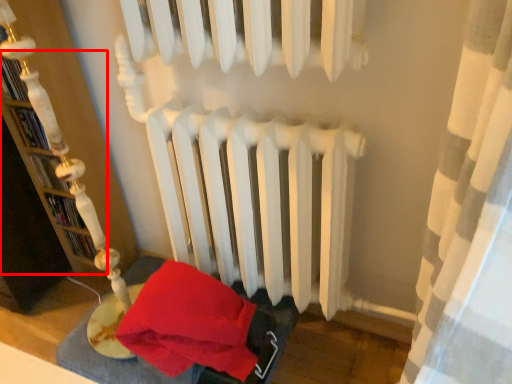
Question: In this image, where is bookshelf (annotated by the red box) located relative to bed frame?

Choices:
 (A) left
 (B) right

Answer: (A)